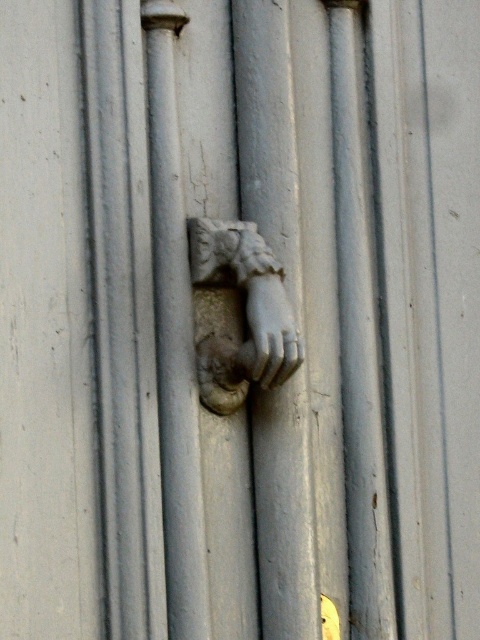
How much distance is there between stone textured hand at center and white marble hand at center?

stone textured hand at center and white marble hand at center are 0.69 inches apart from each other.

Does stone textured hand at center have a smaller size compared to white marble hand at center?

Incorrect, stone textured hand at center is not smaller in size than white marble hand at center.

Which is behind, point (238, 264) or point (276, 364)?

The point (238, 264) is behind.

Locate an element on the screen. The width and height of the screenshot is (480, 640). stone textured hand at center is located at coordinates (245, 314).